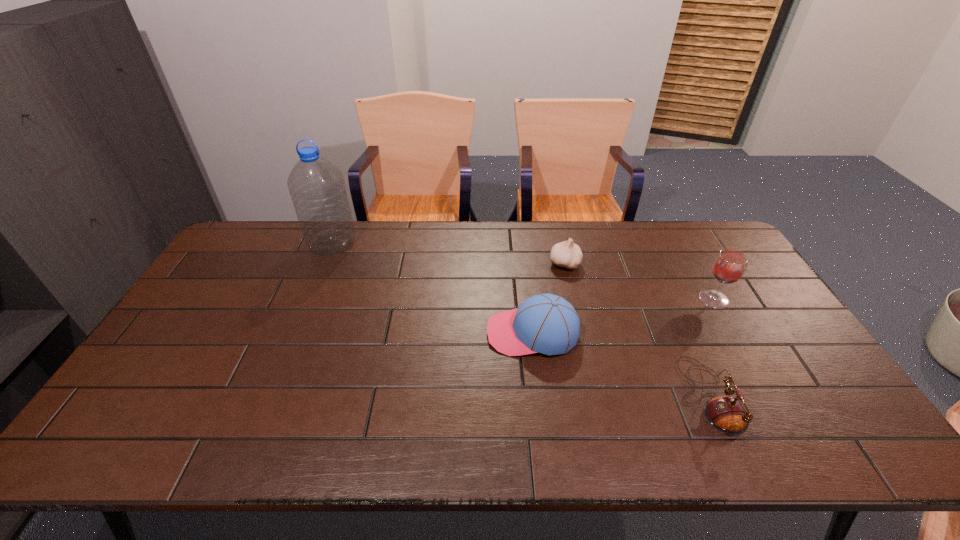
Find the location of a particular element. This screenshot has width=960, height=540. free space between the garlic and the second object from right to left is located at coordinates point(636,329).

Image resolution: width=960 pixels, height=540 pixels. What are the coordinates of `free space between the leftmost object and the garlic` in the screenshot? It's located at (448, 253).

Where is `vacant area that lies between the telephone and the baseball cap`? The width and height of the screenshot is (960, 540). vacant area that lies between the telephone and the baseball cap is located at coordinates (621, 364).

Point out which object is positioned as the nearest to the garlic. Please provide its 2D coordinates. Your answer should be formatted as a tuple, i.e. [(x, y)], where the tuple contains the x and y coordinates of a point satisfying the conditions above.

[(545, 323)]

This screenshot has height=540, width=960. I want to click on object that is the second closest to the fourth object from left to right, so click(545, 323).

Find the location of a particular element. free space that satisfies the following two spatial constraints: 1. on the front side of the fourth shortest object; 2. on the rotary dial of the telephone is located at coordinates (769, 396).